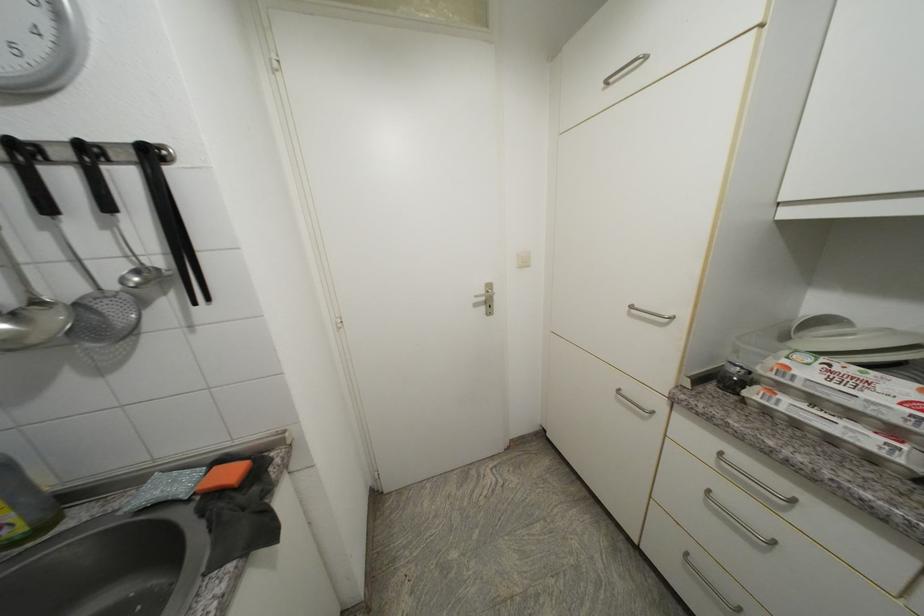
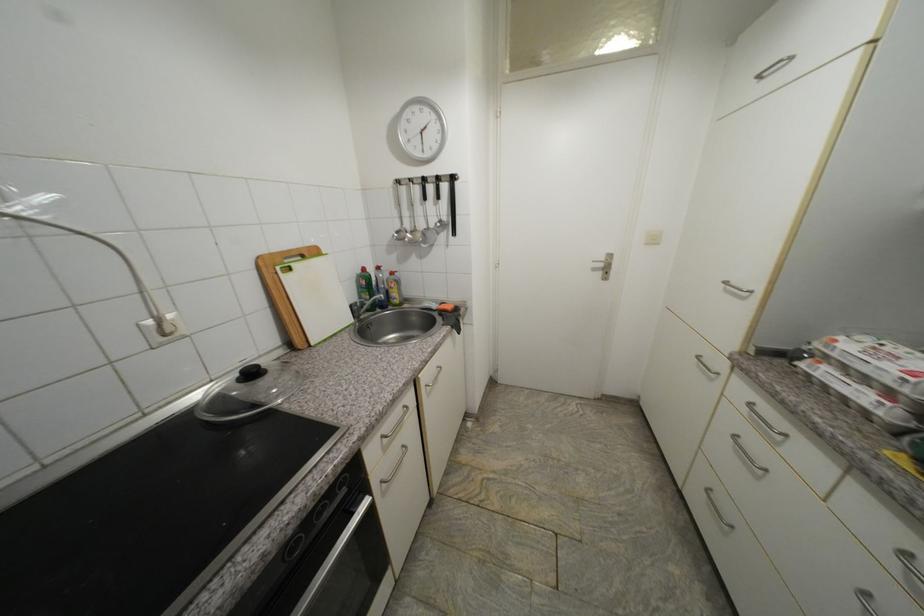
Question: The camera is either moving clockwise (left) or counter-clockwise (right) around the object. The first image is from the beginning of the video and the second image is from the end. Is the camera moving left or right when shooting the video?

Choices:
 (A) Left
 (B) Right

Answer: (B)